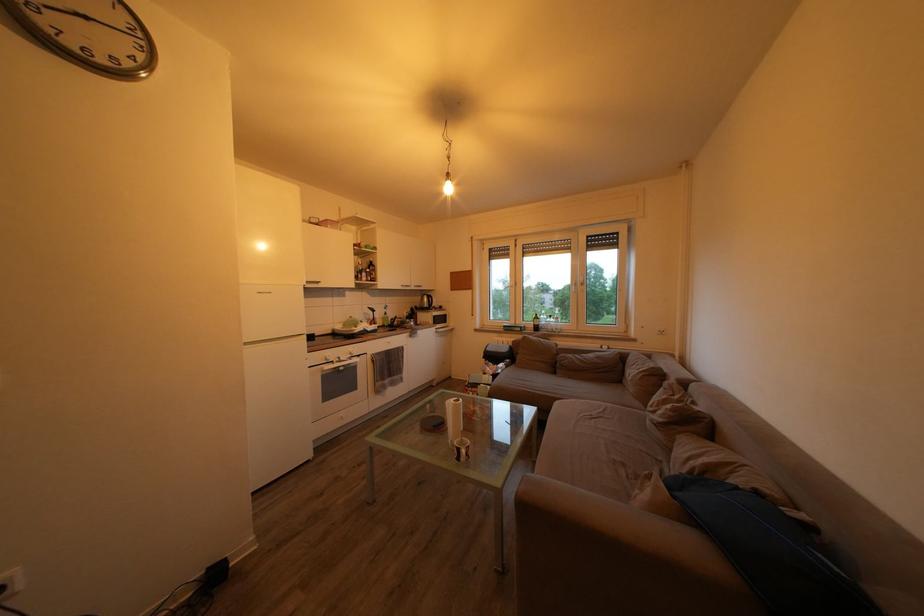
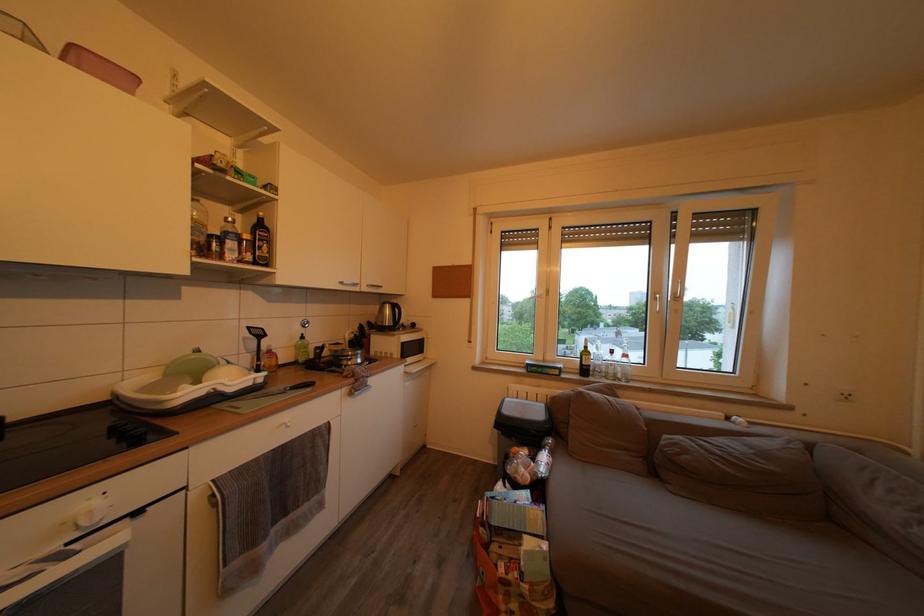
Where in the second image is the point corresponding to pixel 397 325 from the first image?

(320, 353)